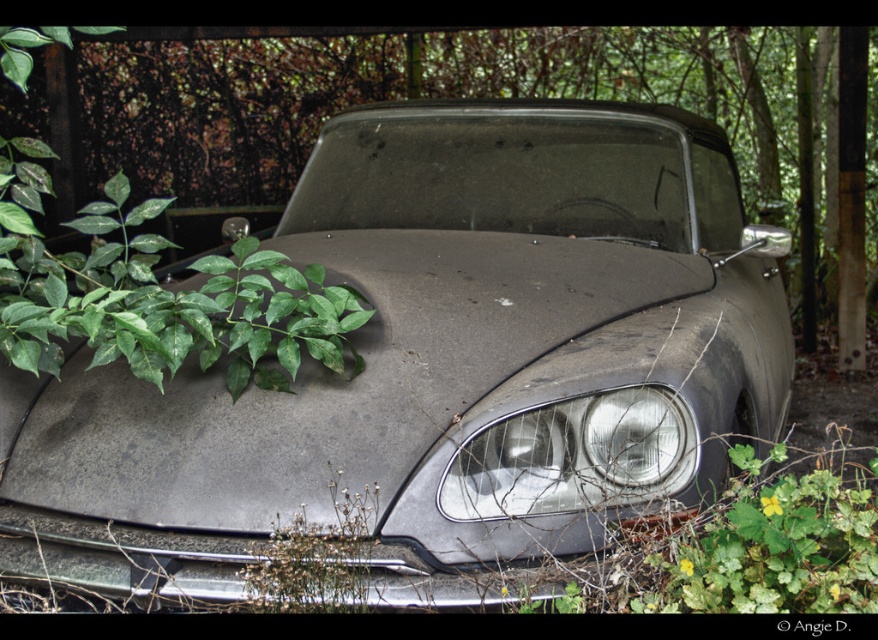
Question: Does matte gray car at center appear on the left side of matte gray headlight at center?

Choices:
 (A) no
 (B) yes

Answer: (B)

Question: From the image, what is the correct spatial relationship of matte gray car at center in relation to matte gray headlight at center?

Choices:
 (A) above
 (B) below

Answer: (A)

Question: Among these points, which one is nearest to the camera?

Choices:
 (A) (59, 72)
 (B) (638, 445)
 (C) (400, 157)

Answer: (B)

Question: Which is nearer to the matte gray headlight at center?

Choices:
 (A) green leafy plant at left
 (B) matte gray car at center

Answer: (B)

Question: Which point is closer to the camera?

Choices:
 (A) matte gray car at center
 (B) matte gray headlight at center

Answer: (A)

Question: Is matte gray car at center further to camera compared to matte gray headlight at center?

Choices:
 (A) yes
 (B) no

Answer: (B)